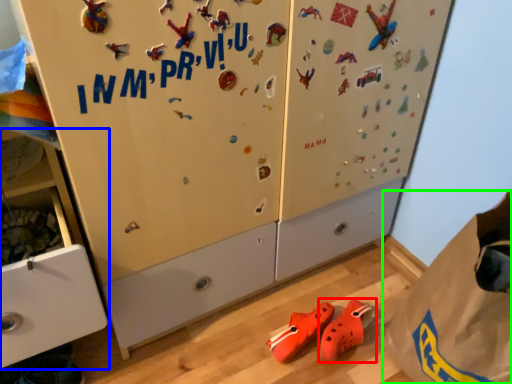
Question: Estimate the real-world distances between objects in this image. Which object is closer to footwear (highlighted by a red box), cabinetry (highlighted by a blue box) or paper bag (highlighted by a green box)?

Choices:
 (A) cabinetry
 (B) paper bag

Answer: (B)